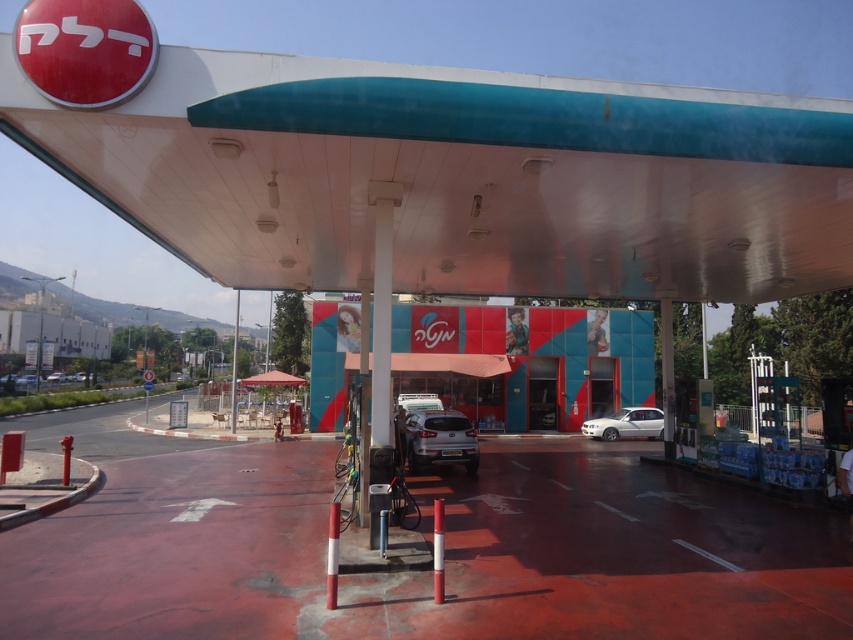
You are standing at the gas station and want to locate two points marked in the image. The first point is at coordinates point (581,394) and the second is at point (631,412). From your position, which point is closer to you?

Point (631,412) is closer to you because point (581,394) is behind it.

Please provide the coordinates of the satin silver suv at center in the image. The coordinate system has the origin at the bottom left corner of the image, with the x and y axes increasing to the right and up respectively.

The satin silver suv at center is located at coordinates x 0.688 and y 0.517.

You are standing at the gas station and want to walk from the entrance to the pump. The entrance is near point (430, 408) and the pump is near point (610, 419). Which direction should you walk to reach the pump?

You should walk forward because point (610, 419) is behind point (430, 408), meaning the pump is located behind the entrance from your perspective.